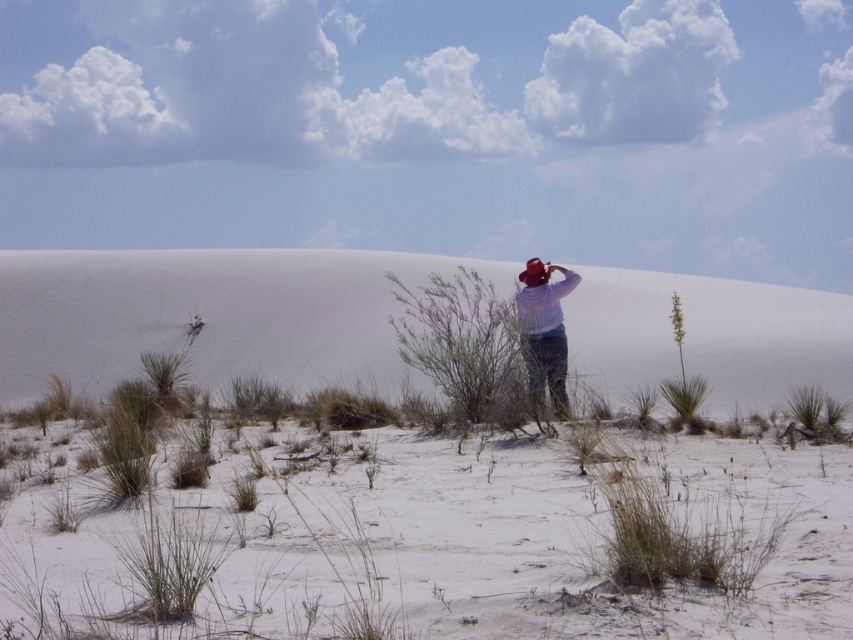
You are a hiker in the desert and need to find a place to set up your tent. You see a white sand dune at center and a green leafy bush at center. Which object is higher and would provide a better vantage point for setting up your tent?

The white sand dune at center is positioned over the green leafy bush at center, making it higher. Therefore, setting up your tent on the white sand dune at center would provide a better vantage point.

You are a photographer trying to capture the plaid shirt at center and the green leafy bush at center in a single shot. Which object should you focus on first if you want to ensure both are in clear view?

The green leafy bush at center is thinner than the plaid shirt at center, so you should focus on the plaid shirt at center first to ensure depth of field covers both objects.

Based on the photo, you are standing at the point marked by coordinates point [448,547] in the desert scene. Based on the description, what type of terrain would you expect to find under your feet?

The point [448,547] indicates white sandy at center, so you would expect to find white sand under your feet.